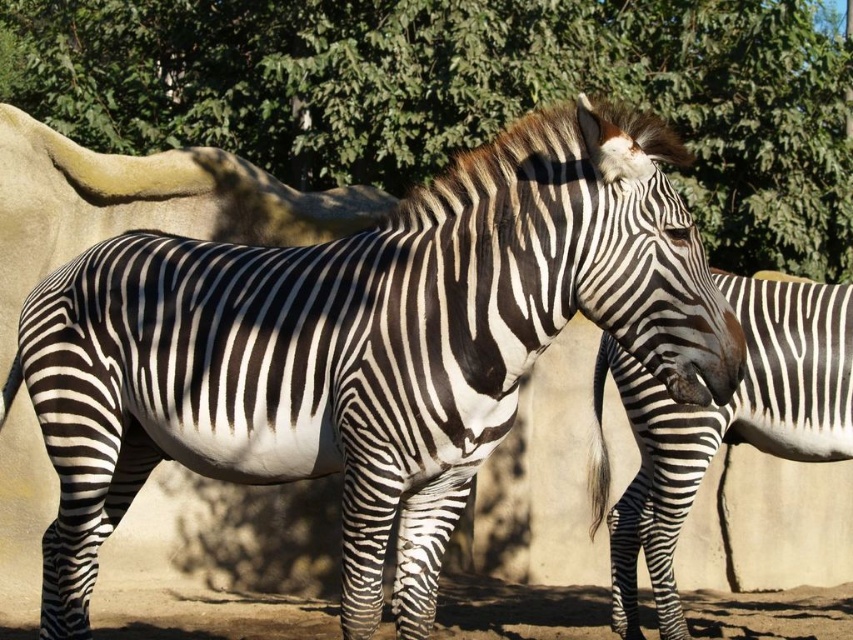
Question: Is black and white striped zebra at center further to camera compared to brown soil at lower center?

Choices:
 (A) no
 (B) yes

Answer: (A)

Question: Is green leafy tree at upper center below brown soil at lower center?

Choices:
 (A) yes
 (B) no

Answer: (B)

Question: Estimate the real-world distances between objects in this image. Which object is farther from the black and white striped zebra at center?

Choices:
 (A) green leafy tree at upper center
 (B) brown soil at lower center

Answer: (A)

Question: Does black and white striped zebra at center appear over brown soil at lower center?

Choices:
 (A) yes
 (B) no

Answer: (A)

Question: Which point is closer to the camera?

Choices:
 (A) (170, 620)
 (B) (254, 68)
 (C) (601, 456)

Answer: (C)

Question: Among these objects, which one is farthest from the camera?

Choices:
 (A) brown soil at lower center
 (B) green leafy tree at upper center

Answer: (B)